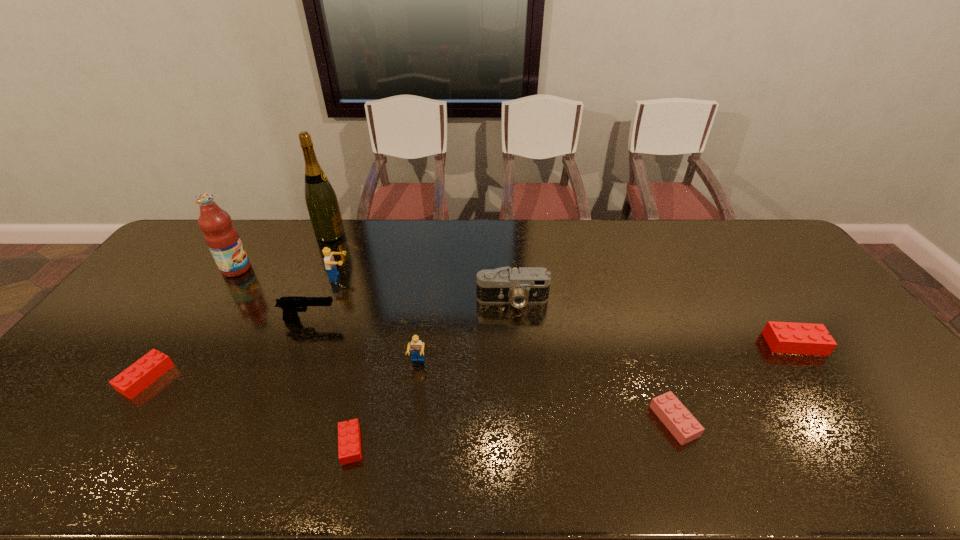
Identify the location of vacant space that satisfies the following two spatial constraints: 1. on the lens of the farthest red Lego; 2. on the left side of the fourth farthest object. Image resolution: width=960 pixels, height=540 pixels. (516, 344).

The height and width of the screenshot is (540, 960). I want to click on vacant region that satisfies the following two spatial constraints: 1. on the front label of the ninth shortest object; 2. on the back side of the shortest Lego, so click(x=123, y=444).

Identify the location of free region that satisfies the following two spatial constraints: 1. on the back side of the shortest object; 2. on the front-facing side of the wine bottle. (400, 234).